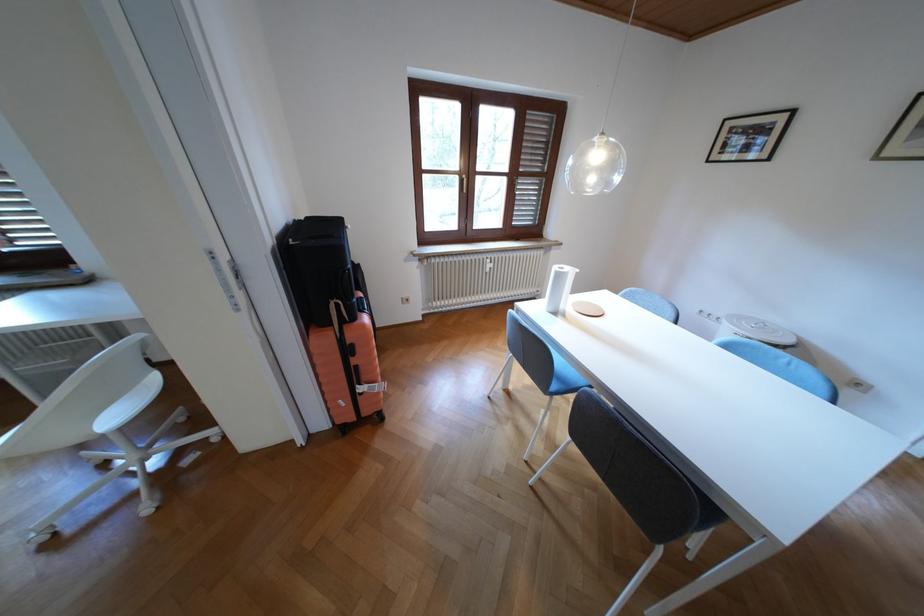
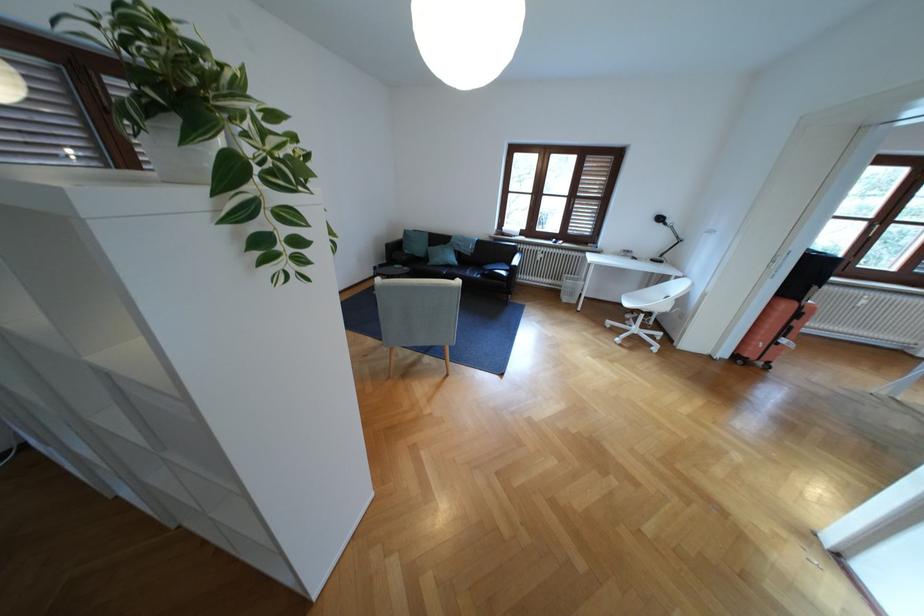
Find the pixel in the second image that matches point 467,177 in the first image.

(877, 224)